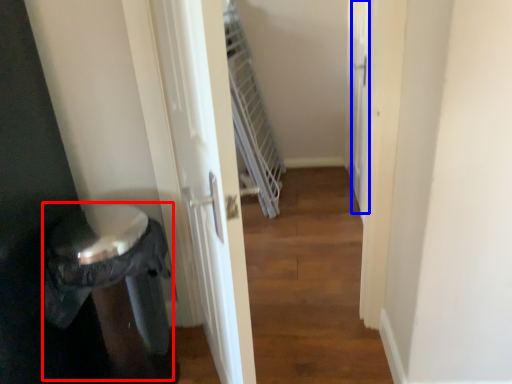
Question: Which object is further to the camera taking this photo, potty (highlighted by a red box) or screen door (highlighted by a blue box)?

Choices:
 (A) potty
 (B) screen door

Answer: (B)